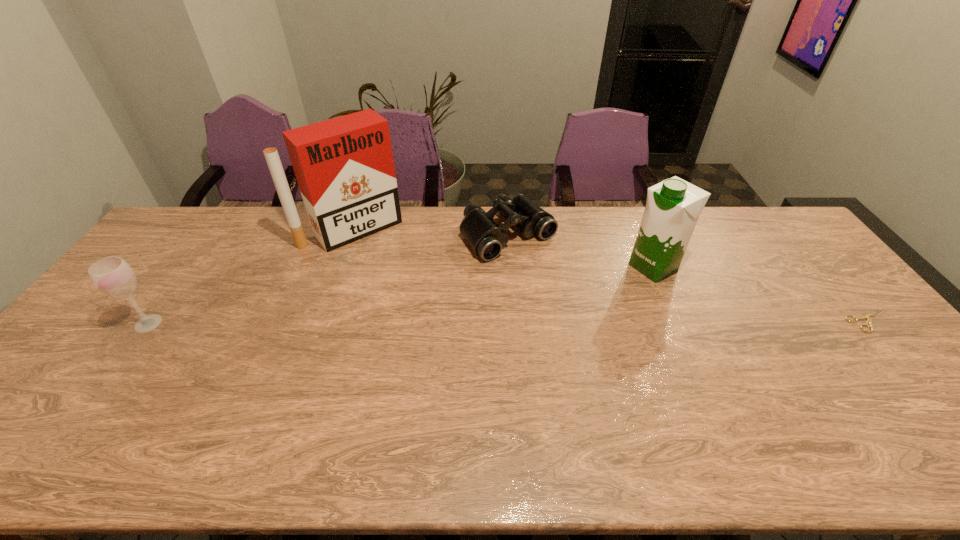
You are a GUI agent. You are given a task and a screenshot of the screen. Output one action in this format:
    pyautogui.click(x=<x>, y=<y>)
    Task: Click on the object identified as the third closest to the fourth tallest object
    
    Given the screenshot: What is the action you would take?
    pyautogui.click(x=868, y=320)

Locate an element on the screen. The height and width of the screenshot is (540, 960). the fourth closest object to the second object from right to left is located at coordinates [113, 276].

Image resolution: width=960 pixels, height=540 pixels. Find the location of `free region that satisfies the following two spatial constraints: 1. on the back side of the binoculars; 2. on the left side of the leftmost object`. free region that satisfies the following two spatial constraints: 1. on the back side of the binoculars; 2. on the left side of the leftmost object is located at coordinates (212, 234).

Where is `vacant point that satisfies the following two spatial constraints: 1. on the front side of the binoculars; 2. on the left side of the tallest object`? The height and width of the screenshot is (540, 960). vacant point that satisfies the following two spatial constraints: 1. on the front side of the binoculars; 2. on the left side of the tallest object is located at coordinates (351, 234).

This screenshot has width=960, height=540. What are the coordinates of `free space that satisfies the following two spatial constraints: 1. on the back side of the fourth object from right to left; 2. on the right side of the wineglass` in the screenshot? It's located at (217, 229).

You are a GUI agent. You are given a task and a screenshot of the screen. Output one action in this format:
    pyautogui.click(x=<x>, y=<y>)
    Task: Click on the free space that satisfies the following two spatial constraints: 1. on the front side of the third object from right to left; 2. on the right side of the second object from right to left
    
    Given the screenshot: What is the action you would take?
    pyautogui.click(x=511, y=267)

Find the location of a particular element. vacant area in the image that satisfies the following two spatial constraints: 1. on the front side of the soya milk; 2. on the right side of the binoculars is located at coordinates (511, 267).

This screenshot has height=540, width=960. Identify the location of free location that satisfies the following two spatial constraints: 1. on the front side of the second shortest object; 2. on the left side of the shears. (515, 321).